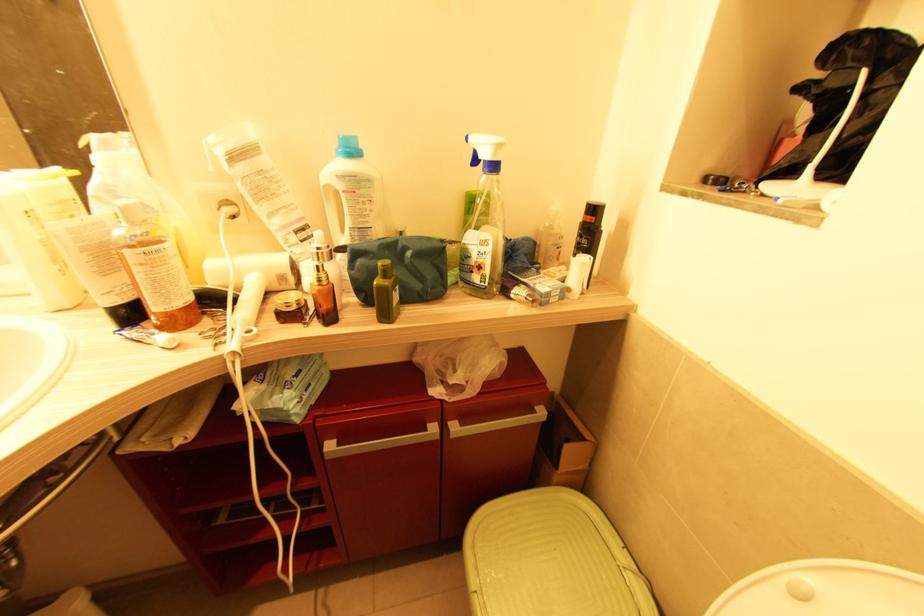
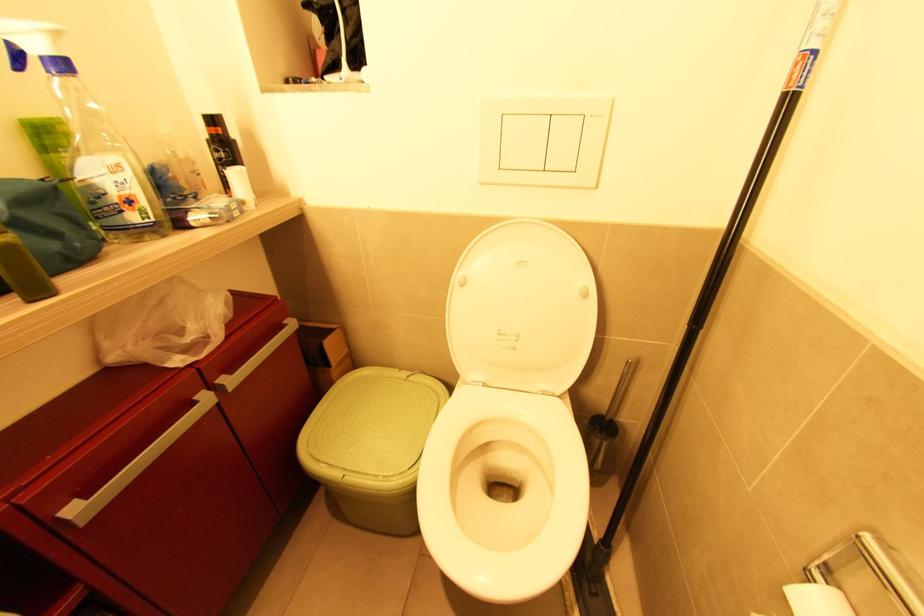
The first image is from the beginning of the video and the second image is from the end. How did the camera likely rotate when shooting the video?

The camera's rotation is toward right-down.